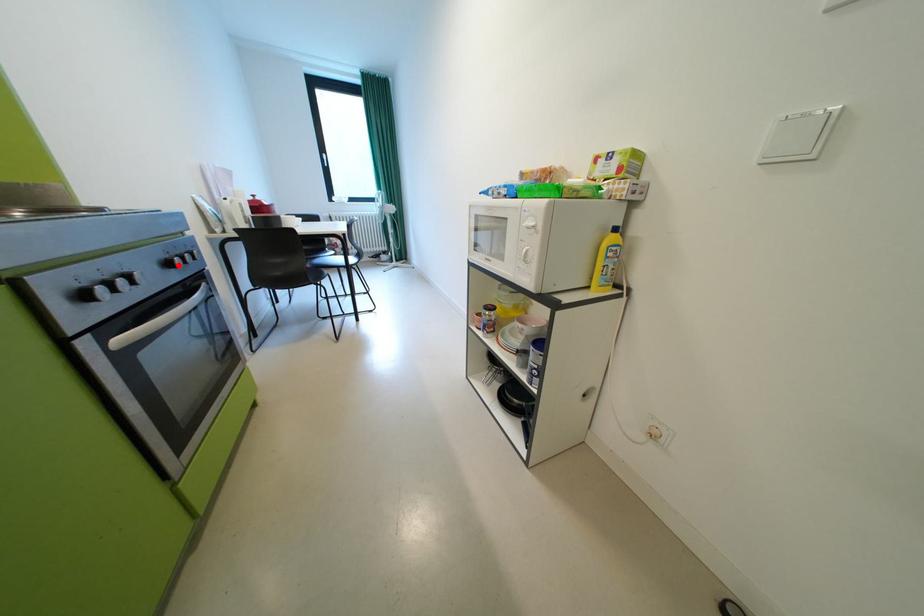
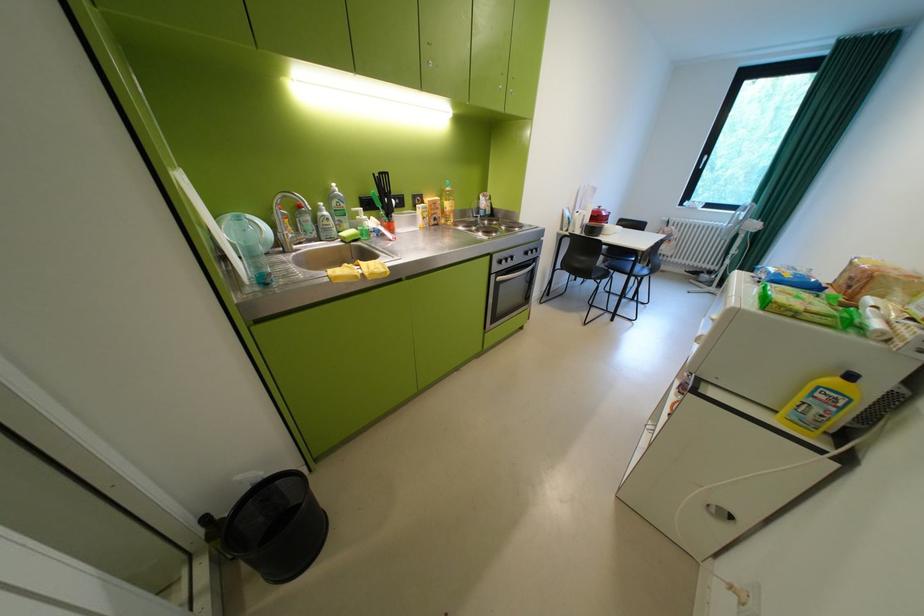
Locate, in the second image, the point that corresponds to the highlighted location in the first image.

(537, 254)